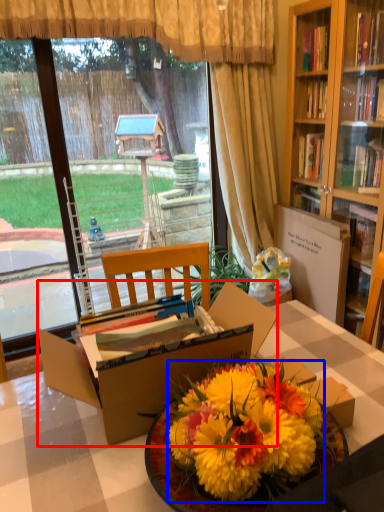
Question: Which object appears closest to the camera in this image, box (highlighted by a red box) or flower (highlighted by a blue box)?

Choices:
 (A) box
 (B) flower

Answer: (B)